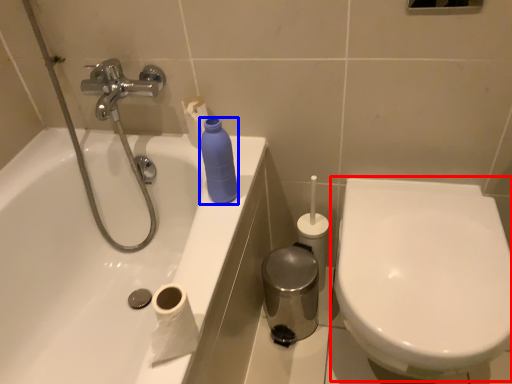
Question: Which object is closer to the camera taking this photo, toilet (highlighted by a red box) or cleaning product (highlighted by a blue box)?

Choices:
 (A) toilet
 (B) cleaning product

Answer: (A)